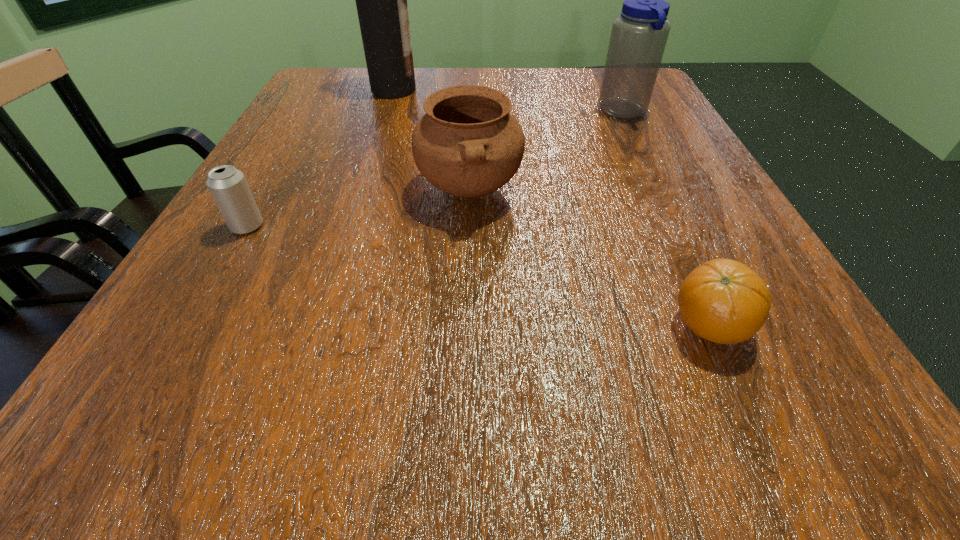
Identify the location of object located at the far left corner. This screenshot has width=960, height=540. (381, 0).

Locate an element on the screen. object at the far right corner is located at coordinates (639, 35).

Where is `vacant region at the far edge of the desktop`? The image size is (960, 540). vacant region at the far edge of the desktop is located at coordinates (568, 80).

Identify the location of vacant area at the near edge of the desktop. This screenshot has height=540, width=960. (373, 429).

Find the location of a particular element. This screenshot has height=540, width=960. vacant space at the left edge is located at coordinates (339, 163).

Locate an element on the screen. The height and width of the screenshot is (540, 960). free space at the right edge is located at coordinates (708, 381).

I want to click on vacant region at the far left corner, so click(326, 81).

I want to click on free space that is in between the water bottle and the third object from left to right, so click(546, 151).

Where is `blank region between the fourth shortest object and the orange`? The image size is (960, 540). blank region between the fourth shortest object and the orange is located at coordinates (666, 219).

You are a GUI agent. You are given a task and a screenshot of the screen. Output one action in this format:
    pyautogui.click(x=<x>, y=<y>)
    Task: Click on the unoccupied area between the fourth object from right to left and the beer can
    The height and width of the screenshot is (540, 960).
    Given the screenshot: What is the action you would take?
    pyautogui.click(x=321, y=158)